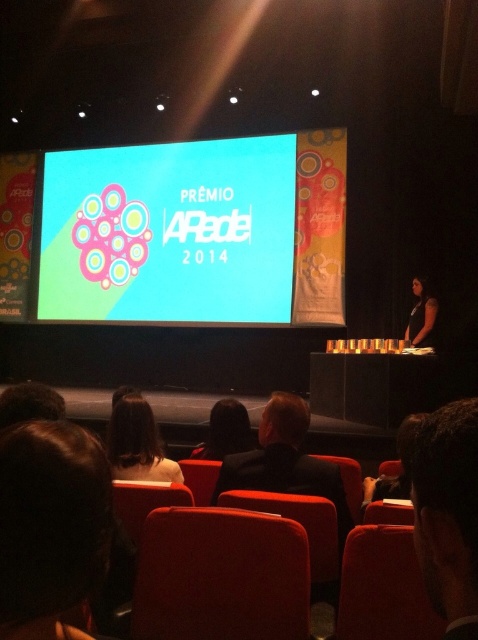
Looking at the audience members in the image, which person has their hair positioned to the right of the other? Specifically, is the dark brown hair at upper right located to the right of the brown hair at lower left?

Yes, the dark brown hair at upper right is positioned to the right of the brown hair at lower left.